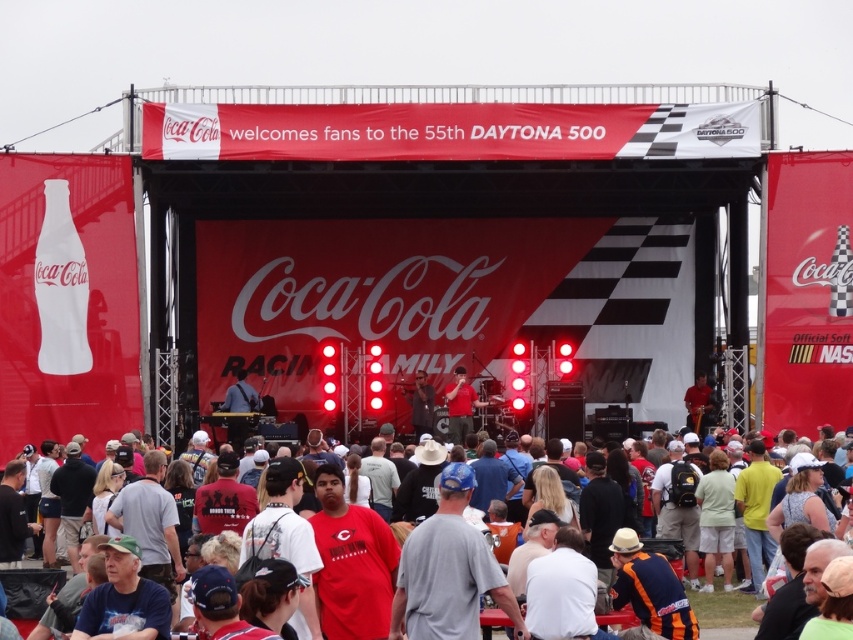
You are a photographer at the 55th Daytona 500 race event. You want to capture a photo of the Coca Cola branded stage and the crowd in front of it. However, there is an object blocking your view at point (722, 608). What is blocking your view?

The object blocking your view at point (722, 608) is white cotton t shirts at lower center.

You are a photographer at the Coca Cola stage during the 55th Daytona 500 race. You need to capture a clear photo of the matte black microphone at center without the red matte shirt at center blocking it. What should you do?

The red matte shirt at center is located above the matte black microphone at center. To avoid blocking the microphone, you should position the camera below the microphone or adjust the angle to capture it from a lower perspective so the shirt doesn not obstruct the view.

Based on the photo, you are a photographer at the event and need to capture a clear shot of both the red matte shirt at center and the matte black microphone at center. Since the camera has a limited focus range, which object should you prioritize focusing on to ensure it appears sharp in the photo?

The red matte shirt at center has a larger width than the matte black microphone at center. Therefore, you should prioritize focusing on the red matte shirt at center because its larger size will require more precise focus to maintain sharpness.